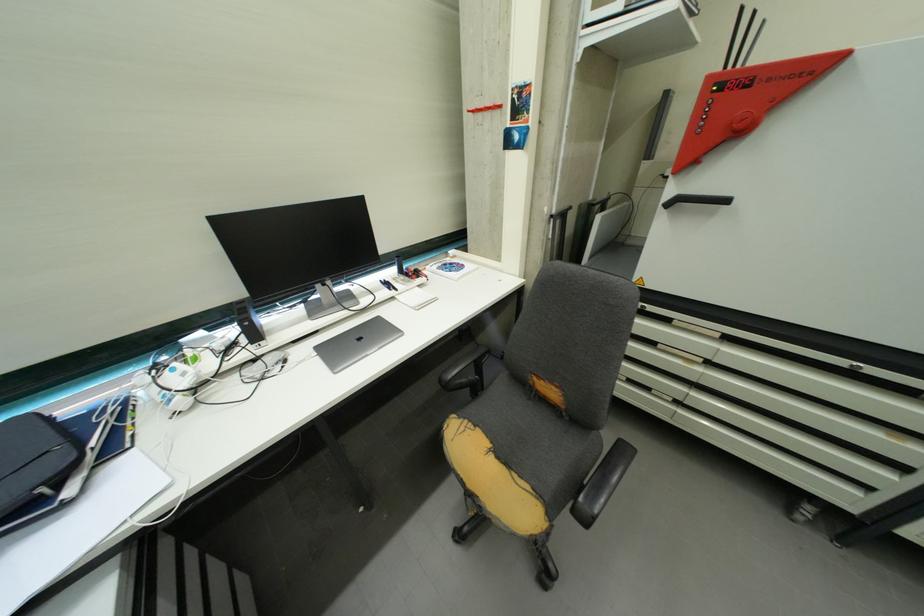
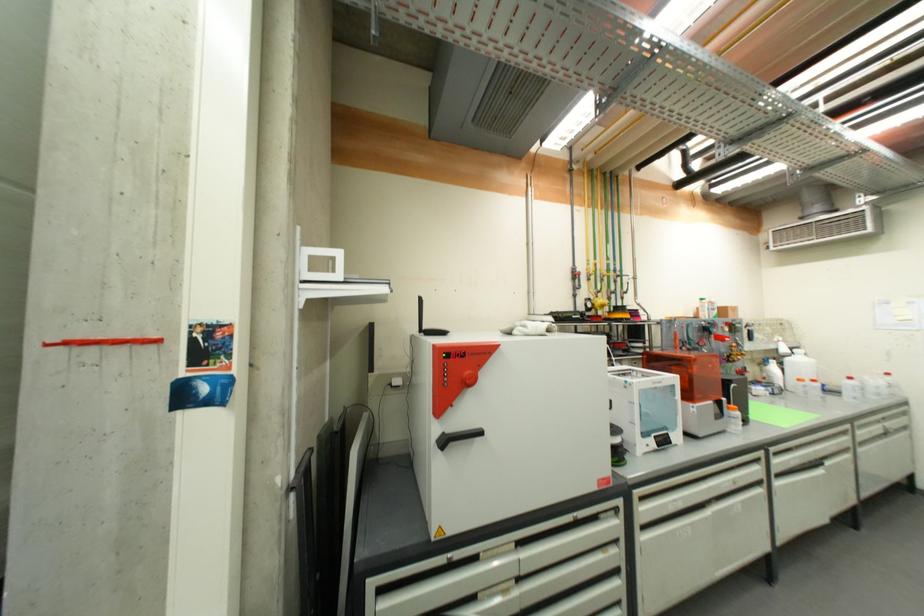
In the second image, find the point that corresponds to (x=734, y=341) in the first image.

(525, 546)